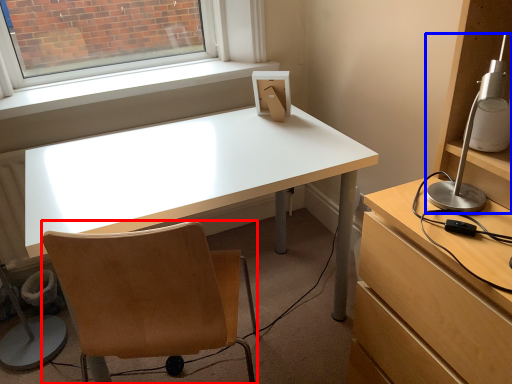
Question: Which object appears closest to the camera in this image, chair (highlighted by a red box) or lamp (highlighted by a blue box)?

Choices:
 (A) chair
 (B) lamp

Answer: (B)